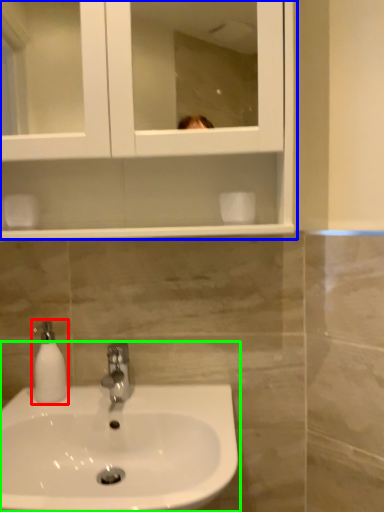
Question: Which object is the farthest from soap dispenser (highlighted by a red box)? Choose among these: medicine cabinet (highlighted by a blue box) or sink (highlighted by a green box).

Choices:
 (A) medicine cabinet
 (B) sink

Answer: (A)